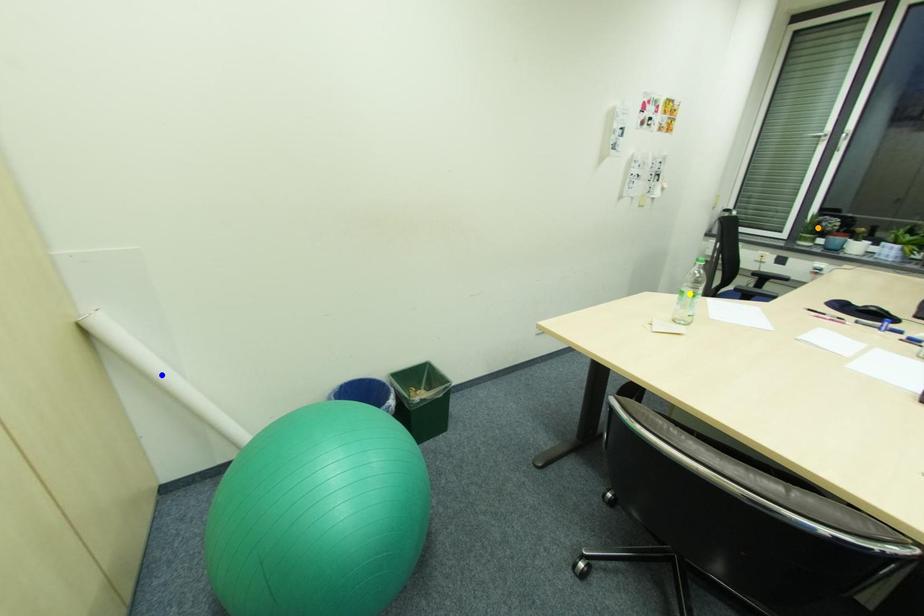
From the picture: Order these from nearest to farthest:
blue point, yellow point, orange point

blue point
yellow point
orange point